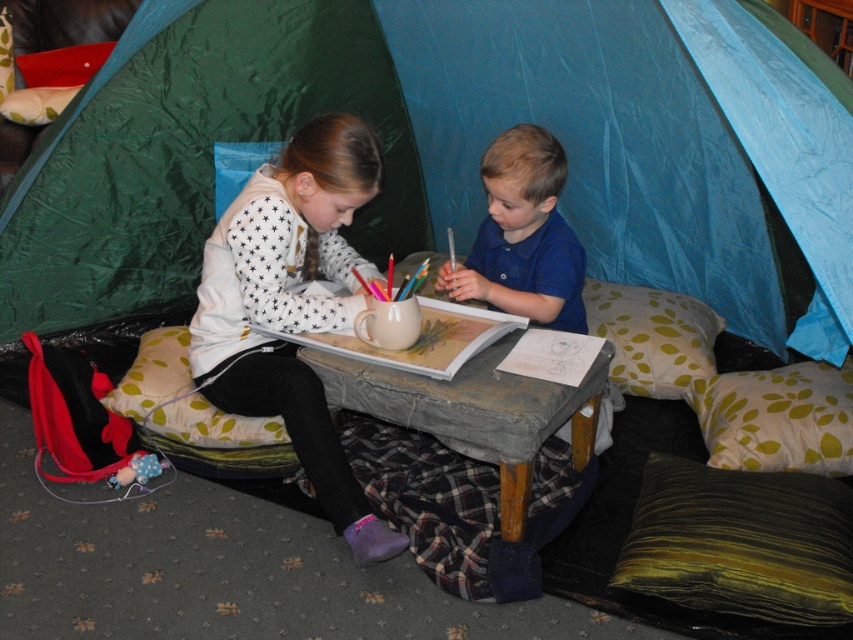
You are a photographer standing at the origin point of the coordinate system. You want to take a photo of the green fabric tent at center. What are the coordinates where you should aim your camera?

The coordinates to aim the camera are at point (x=450, y=147), as the green fabric tent at center is located there.

You are a parent trying to hand a snack to your child. You are standing near the blue cotton shirt at center and the fluffy beige pillow at lower left. Which object is closer to you so you can place the snack there?

The blue cotton shirt at center and fluffy beige pillow at lower left are 32.78 inches apart from each other. Since you are standing near the blue cotton shirt at center, you can place the snack there as it is closer to you.